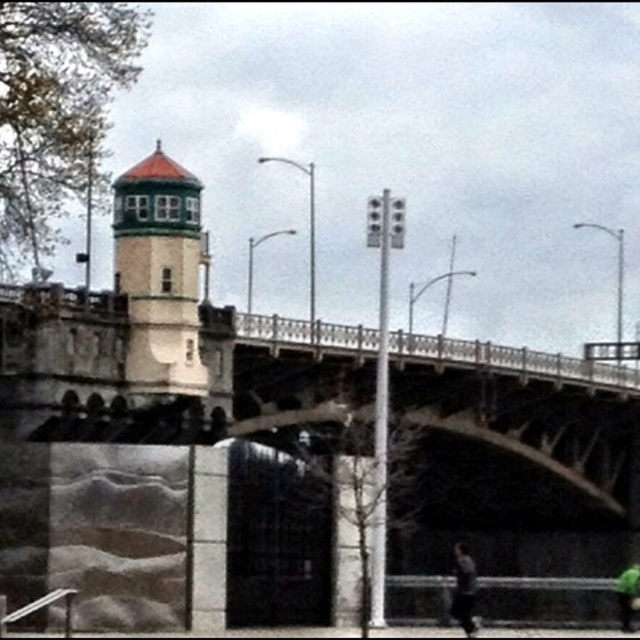
Does concrete bridge at center lie in front of dark gray smooth skateboarder at lower right?

No, it is not.

Does concrete bridge at center appear on the right side of dark gray smooth skateboarder at lower right?

No, concrete bridge at center is not to the right of dark gray smooth skateboarder at lower right.

This screenshot has width=640, height=640. What are the coordinates of `concrete bridge at center` in the screenshot? It's located at (525, 413).

Is point (182, 298) positioned after point (621, 624)?

Yes, it is.

Is white painted brick bell tower at upper left wider than green matte skateboard at lower right?

No, white painted brick bell tower at upper left is not wider than green matte skateboard at lower right.

Who is more forward, (145,336) or (624,611)?

Point (624,611) is more forward.

The height and width of the screenshot is (640, 640). In order to click on white painted brick bell tower at upper left in this screenshot , I will do `click(160, 275)`.

Between concrete bridge at center and white painted brick bell tower at upper left, which one has more height?

With more height is concrete bridge at center.

How much distance is there between concrete bridge at center and white painted brick bell tower at upper left?

The distance of concrete bridge at center from white painted brick bell tower at upper left is 86.91 feet.

This screenshot has height=640, width=640. What are the coordinates of `concrete bridge at center` in the screenshot? It's located at (525, 413).

Identify the location of concrete bridge at center. point(525,413).